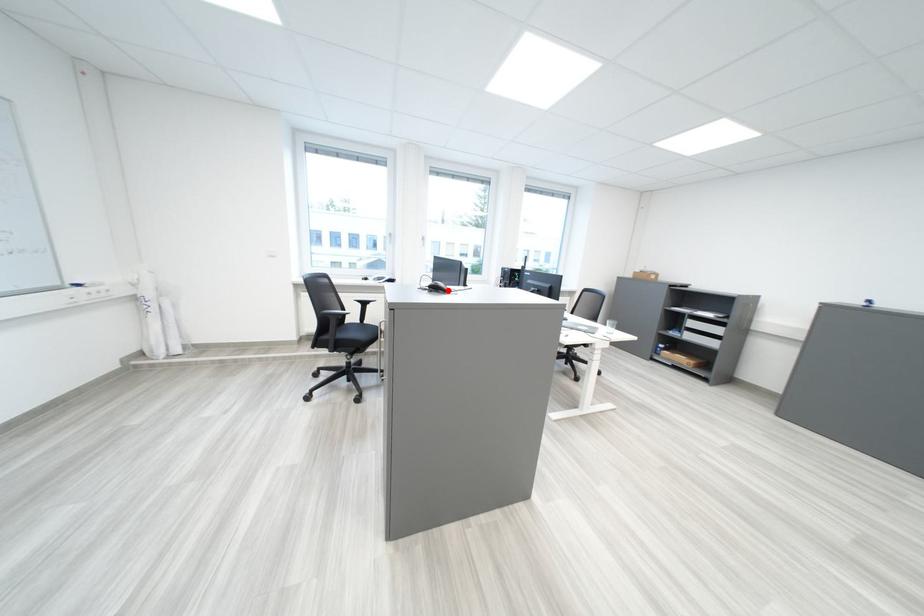
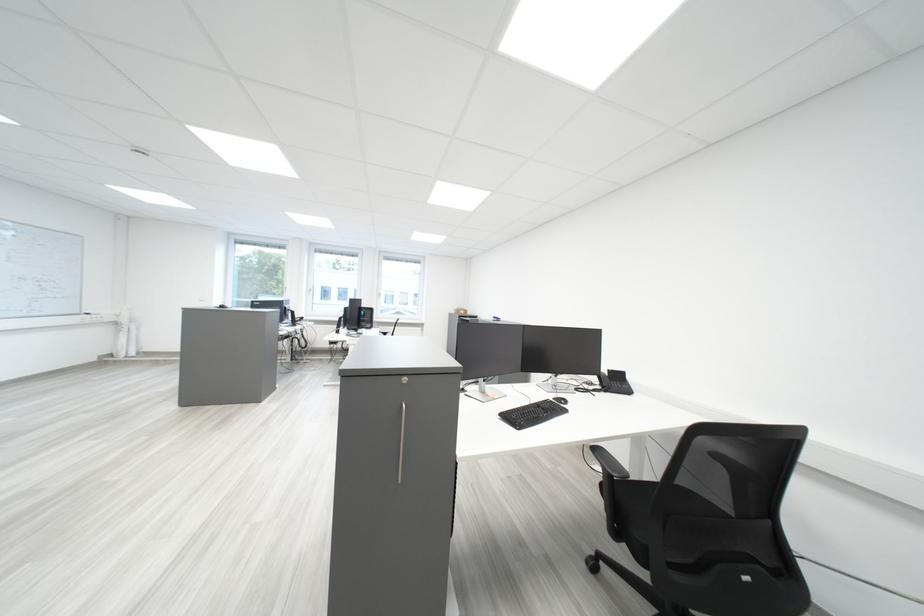
Question: I am providing you with two images of the same scene from different viewpoints. A red point is marked on the first image. At the location where the point appears in image 1, is it still visible in image 2?

Choices:
 (A) Yes
 (B) No

Answer: (B)